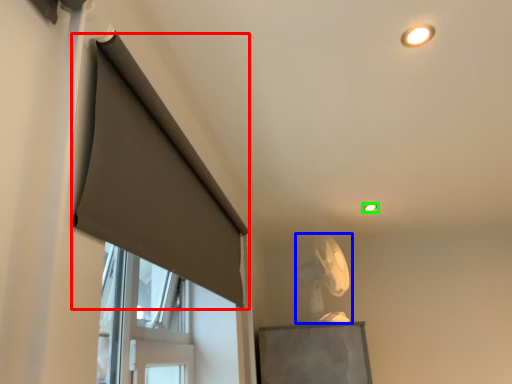
Question: Based on their relative distances, which object is farther from curtain (highlighted by a red box)? Choose from fan (highlighted by a blue box) and lighting (highlighted by a green box).

Choices:
 (A) fan
 (B) lighting

Answer: (B)